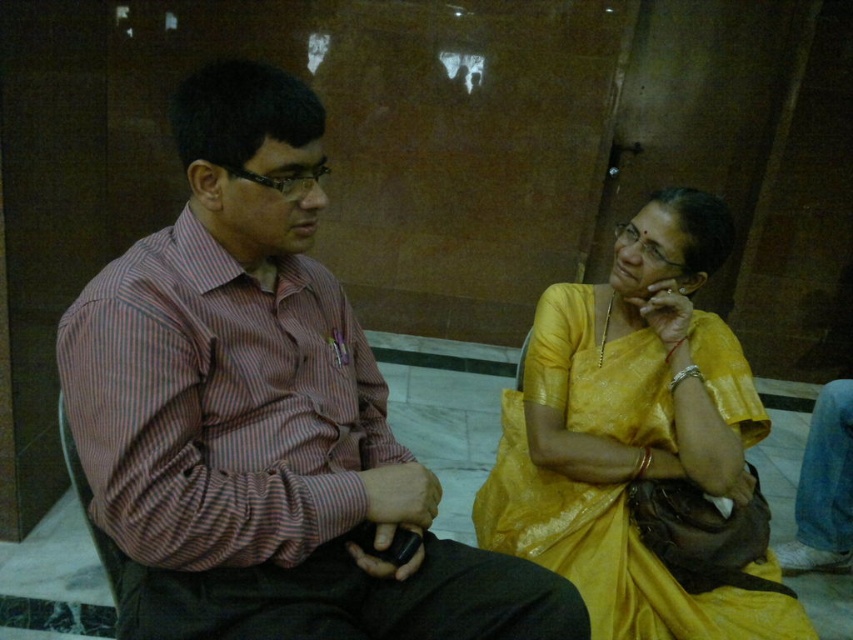
Question: Does striped cotton shirt at left appear over matte yellow saree at right?

Choices:
 (A) yes
 (B) no

Answer: (A)

Question: Can you confirm if striped cotton shirt at left is positioned below matte yellow saree at right?

Choices:
 (A) no
 (B) yes

Answer: (A)

Question: Which point appears closest to the camera in this image?

Choices:
 (A) (712, 595)
 (B) (200, 346)

Answer: (B)

Question: Can you confirm if striped cotton shirt at left is bigger than matte yellow saree at right?

Choices:
 (A) no
 (B) yes

Answer: (A)

Question: Among these objects, which one is farthest from the camera?

Choices:
 (A) matte yellow saree at right
 (B) striped cotton shirt at left

Answer: (A)